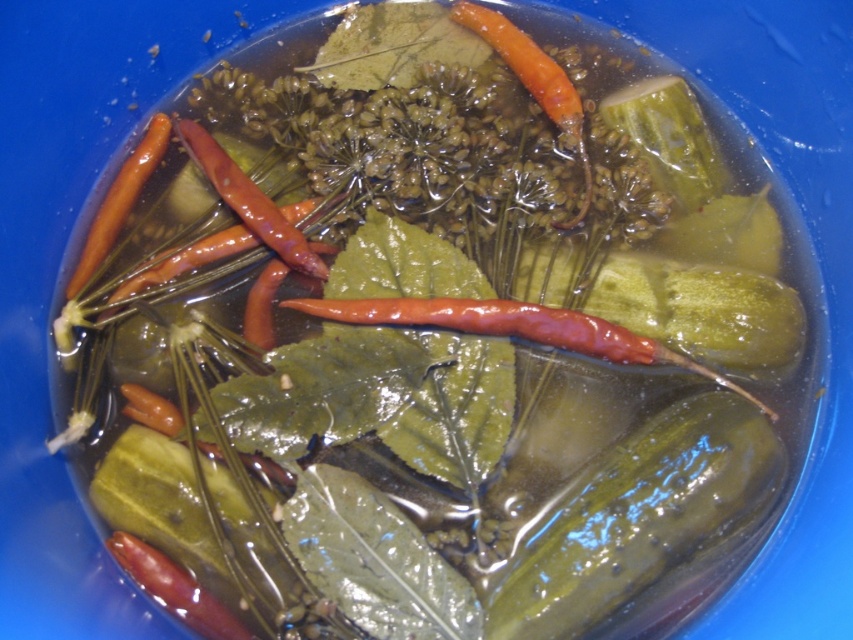
Is orange glossy carrot at center to the right of bright orange carrot at center from the viewer's perspective?

Indeed, orange glossy carrot at center is positioned on the right side of bright orange carrot at center.

Between orange glossy carrot at center and bright orange carrot at center, which one has more height?

orange glossy carrot at center

The width and height of the screenshot is (853, 640). What do you see at coordinates (532, 81) in the screenshot?
I see `orange glossy carrot at center` at bounding box center [532, 81].

In order to click on orange glossy carrot at center in this screenshot , I will do `click(532, 81)`.

Measure the distance between point (496, 22) and camera.

Point (496, 22) is 4.06 feet from camera.

Can you confirm if orange glossy carrot at center is taller than orange glossy carrot at upper left?

Yes, orange glossy carrot at center is taller than orange glossy carrot at upper left.

The height and width of the screenshot is (640, 853). Describe the element at coordinates (532, 81) in the screenshot. I see `orange glossy carrot at center` at that location.

The height and width of the screenshot is (640, 853). In order to click on orange glossy carrot at center in this screenshot , I will do `click(532, 81)`.

Between green glossy pickle at center and bright orange carrot at center, which one appears on the left side from the viewer's perspective?

From the viewer's perspective, bright orange carrot at center appears more on the left side.

This screenshot has width=853, height=640. What do you see at coordinates (634, 516) in the screenshot?
I see `green glossy pickle at center` at bounding box center [634, 516].

Which is behind, point (624, 600) or point (235, 177)?

The point (235, 177) is behind.

Locate an element on the screen. The image size is (853, 640). green glossy pickle at center is located at coordinates (634, 516).